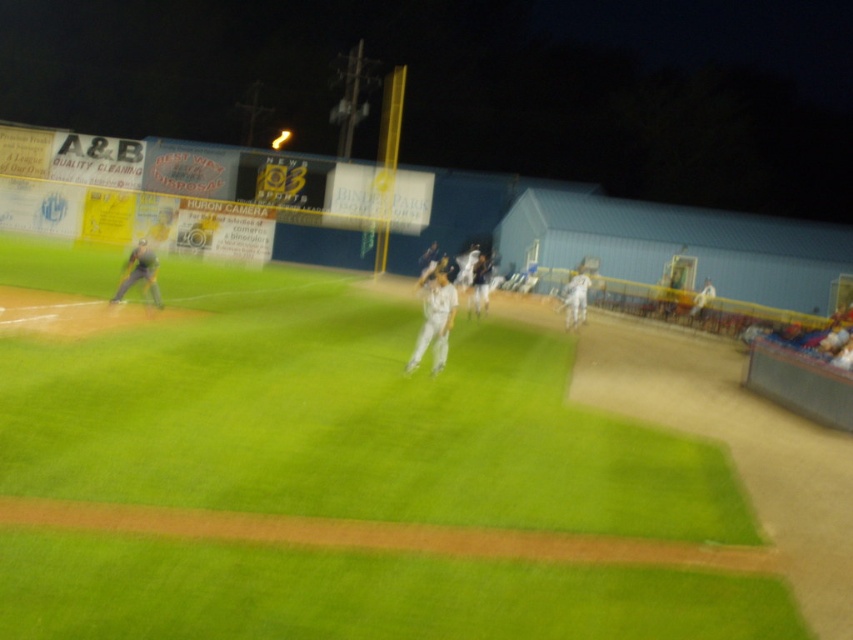
Does white uniform at center have a greater height compared to dark gray uniform at left?

Yes, white uniform at center is taller than dark gray uniform at left.

Does white uniform at center have a smaller size compared to dark gray uniform at left?

Indeed, white uniform at center has a smaller size compared to dark gray uniform at left.

Between point (442, 333) and point (120, 280), which one is positioned behind?

Positioned behind is point (120, 280).

Find the location of `white uniform at center`. white uniform at center is located at coordinates (434, 321).